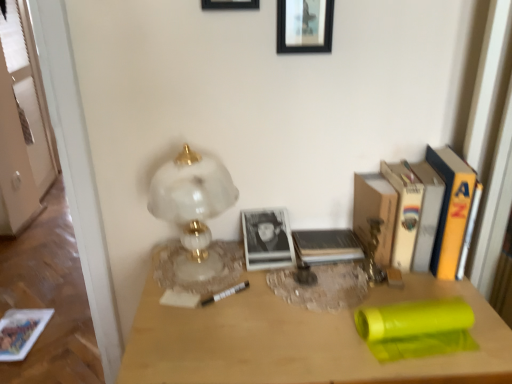
I want to click on vacant region above matte wood desk at center (from a real-world perspective), so click(x=291, y=300).